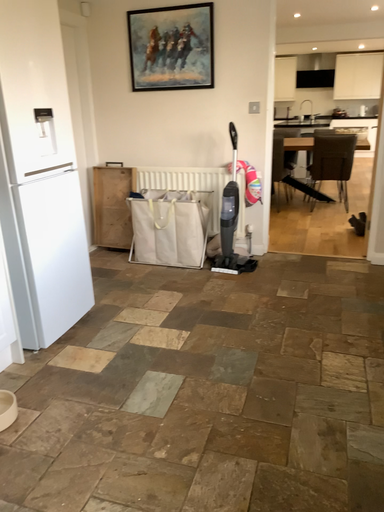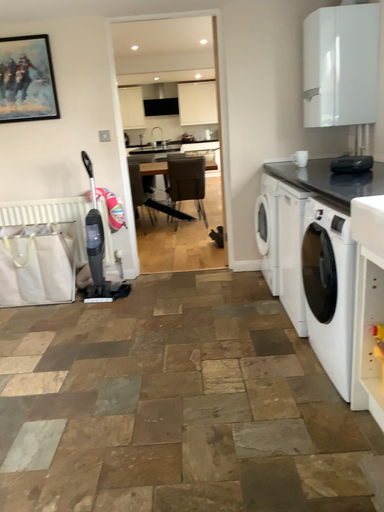
Question: Which way did the camera rotate in the video?

Choices:
 (A) rotated left
 (B) rotated right

Answer: (B)